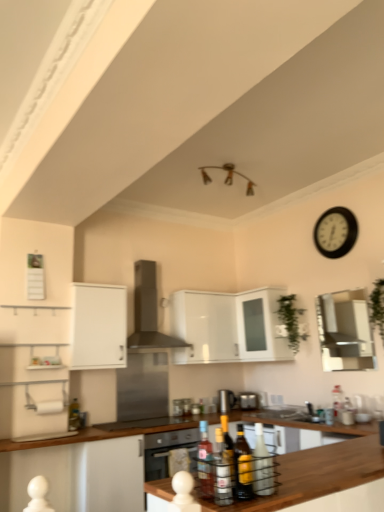
This screenshot has height=512, width=384. Identify the location of free point in front of satin silver toaster at center, marked as the third appliance in a left-to-right arrangement. (248, 412).